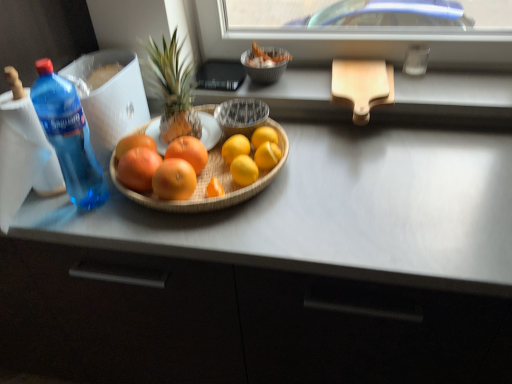
The height and width of the screenshot is (384, 512). Find the location of `empty space that is to the right of bamboo tray at center`. empty space that is to the right of bamboo tray at center is located at coordinates (355, 181).